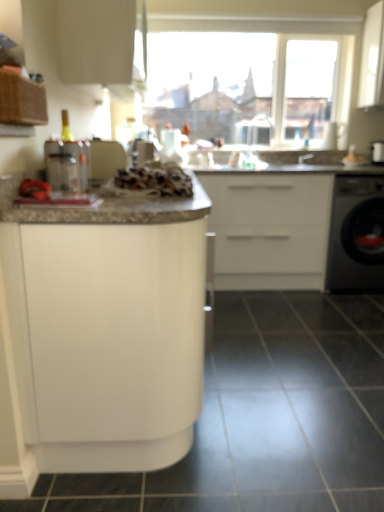
This screenshot has width=384, height=512. What do you see at coordinates (106, 328) in the screenshot?
I see `white glossy cabinet at center, which is the 1th cabinetry in bottom-to-top order` at bounding box center [106, 328].

How much space does white glossy cabinet at upper center, which is counted as the 1th cabinetry, starting from the top, occupy horizontally?

It is 14.35 inches.

This screenshot has width=384, height=512. What do you see at coordinates (266, 417) in the screenshot? I see `black glossy tile at lower center` at bounding box center [266, 417].

Locate an element on the screen. The height and width of the screenshot is (512, 384). satin nickel faucet at center, the second faucet viewed from the left is located at coordinates [x=305, y=157].

Find the location of a particular element. The height and width of the screenshot is (512, 384). white textured bread at center is located at coordinates (155, 180).

Measure the distance between white textured bread at center and camera.

1.49 meters.

What do you see at coordinates (356, 234) in the screenshot? This screenshot has height=512, width=384. I see `black glossy dishwasher at right` at bounding box center [356, 234].

Identify the location of white glossy cabinet at center, which is the 1th cabinetry in bottom-to-top order. This screenshot has width=384, height=512. (106, 328).

Based on their positions, is white glossy cabinet at upper center, which is counted as the 1th cabinetry, starting from the top, located to the left or right of transparent glass window at upper center?

white glossy cabinet at upper center, which is counted as the 1th cabinetry, starting from the top, is positioned on transparent glass window at upper center's left side.

Would you say white glossy cabinet at upper center, which is counted as the 1th cabinetry, starting from the top, contains transparent glass window at upper center?

No, transparent glass window at upper center is not a part of white glossy cabinet at upper center, which is counted as the 1th cabinetry, starting from the top.

From the image's perspective, is white matte cabinet at center, placed as the 2th cabinetry when sorted from top to bottom, located above clear plastic faucet at upper center, positioned as the second faucet in right-to-left order?

No.

Is white matte cabinet at center, placed as the 2th cabinetry when sorted from top to bottom, inside or outside of clear plastic faucet at upper center, which ranks as the first faucet in left-to-right order?

white matte cabinet at center, placed as the 2th cabinetry when sorted from top to bottom, is not enclosed by clear plastic faucet at upper center, which ranks as the first faucet in left-to-right order.

In the scene shown: Is transparent glass window at upper center at the right side of black glossy dishwasher at right?

No, transparent glass window at upper center is not to the right of black glossy dishwasher at right.

Considering the relative sizes of transparent glass window at upper center and black glossy dishwasher at right in the image provided, is transparent glass window at upper center shorter than black glossy dishwasher at right?

Incorrect, the height of transparent glass window at upper center does not fall short of that of black glossy dishwasher at right.

Are transparent glass window at upper center and black glossy dishwasher at right making contact?

No, transparent glass window at upper center is not next to black glossy dishwasher at right.

Can you confirm if clear plastic container at left is shorter than satin nickel faucet at center, placed as the first faucet when sorted from right to left?

No, clear plastic container at left is not shorter than satin nickel faucet at center, placed as the first faucet when sorted from right to left.

Considering the positions of points (114, 146) and (309, 158), is point (114, 146) closer to camera compared to point (309, 158)?

Yes, point (114, 146) is in front of point (309, 158).

Looking at the image, does clear plastic container at left seem bigger or smaller compared to satin nickel faucet at center, placed as the first faucet when sorted from right to left?

clear plastic container at left is bigger than satin nickel faucet at center, placed as the first faucet when sorted from right to left.

From the picture: How much distance is there between clear plastic container at left and satin nickel faucet at center, the second faucet viewed from the left?

clear plastic container at left is 7.13 feet from satin nickel faucet at center, the second faucet viewed from the left.

Which of these two, white glossy cabinet at upper center, positioned as the third cabinetry in bottom-to-top order, or black glossy tile at lower center, is bigger?

Bigger between the two is white glossy cabinet at upper center, positioned as the third cabinetry in bottom-to-top order.

The width and height of the screenshot is (384, 512). What are the coordinates of `tile below the white glossy cabinet at upper center, positioned as the third cabinetry in bottom-to-top order (from the image's perspective)` in the screenshot? It's located at (266, 417).

How far apart are white glossy cabinet at upper center, positioned as the third cabinetry in bottom-to-top order, and black glossy tile at lower center?

white glossy cabinet at upper center, positioned as the third cabinetry in bottom-to-top order, and black glossy tile at lower center are 5.33 feet apart.

Does white glossy cabinet at upper center, which is counted as the 1th cabinetry, starting from the top, come in front of black glossy tile at lower center?

No.

Based on the photo, from the image's perspective, between satin nickel faucet at center, placed as the first faucet when sorted from right to left, and white textured bread at center, which one is located above?

From the image's view, satin nickel faucet at center, placed as the first faucet when sorted from right to left, is above.

Considering the relative sizes of satin nickel faucet at center, placed as the first faucet when sorted from right to left, and white textured bread at center in the image provided, is satin nickel faucet at center, placed as the first faucet when sorted from right to left, taller than white textured bread at center?

In fact, satin nickel faucet at center, placed as the first faucet when sorted from right to left, may be shorter than white textured bread at center.

How many degrees apart are the facing directions of satin nickel faucet at center, placed as the first faucet when sorted from right to left, and white textured bread at center?

There is a 89.7-degree angle between the facing directions of satin nickel faucet at center, placed as the first faucet when sorted from right to left, and white textured bread at center.

The height and width of the screenshot is (512, 384). There is a white textured bread at center. What are the coordinates of `the 1st faucet above it (from the image's perspective)` in the screenshot? It's located at (305, 157).

Is clear plastic container at left not close to transparent glass window at upper center?

Yes, clear plastic container at left is far from transparent glass window at upper center.

Does clear plastic container at left have a lesser height compared to transparent glass window at upper center?

Yes.

Looking at this image, from the image's perspective, between clear plastic container at left and transparent glass window at upper center, who is located below?

From the image's view, clear plastic container at left is below.

Who is more distant, clear plastic container at left or transparent glass window at upper center?

transparent glass window at upper center.

There is a transparent glass window at upper center. Identify the location of the 1st cabinetry below it (from the image's perspective). (103, 41).

From a real-world perspective, which cabinetry is the 2nd one underneath the clear plastic faucet at upper center, which ranks as the first faucet in left-to-right order? Please provide its 2D coordinates.

[(269, 229)]

When comparing their distances from white glossy cabinet at upper center, which is counted as the 1th cabinetry, starting from the top, does clear plastic container at left or clear plastic faucet at upper center, positioned as the second faucet in right-to-left order, seem closer?

Among the two, clear plastic container at left is located nearer to white glossy cabinet at upper center, which is counted as the 1th cabinetry, starting from the top.

Looking at the image, which one is located closer to white glossy cabinet at upper center, positioned as the third cabinetry in bottom-to-top order, transparent glass window at upper center or black glossy dishwasher at right?

transparent glass window at upper center.

Looking at the image, which one is located further to satin nickel faucet at center, the second faucet viewed from the left, clear plastic container at left or clear plastic faucet at upper center, positioned as the second faucet in right-to-left order?

clear plastic container at left.

Based on their spatial positions, is clear plastic faucet at upper center, which ranks as the first faucet in left-to-right order, or white glossy cabinet at upper center, which is counted as the 1th cabinetry, starting from the top, further from black glossy dishwasher at right?

The object further to black glossy dishwasher at right is white glossy cabinet at upper center, which is counted as the 1th cabinetry, starting from the top.

Which object lies further to the anchor point white textured bread at center, black glossy dishwasher at right or clear plastic faucet at upper center, positioned as the second faucet in right-to-left order?

clear plastic faucet at upper center, positioned as the second faucet in right-to-left order, is positioned further to the anchor white textured bread at center.

Consider the image. Which object lies nearer to the anchor point black glossy dishwasher at right, clear plastic faucet at upper center, positioned as the second faucet in right-to-left order, or black glossy tile at lower center?

clear plastic faucet at upper center, positioned as the second faucet in right-to-left order, is positioned closer to the anchor black glossy dishwasher at right.

Estimate the real-world distances between objects in this image. Which object is closer to white textured bread at center, clear plastic container at left or satin nickel faucet at center, placed as the first faucet when sorted from right to left?

clear plastic container at left is positioned closer to the anchor white textured bread at center.

In the scene shown: Which object lies nearer to the anchor point clear plastic faucet at upper center, positioned as the second faucet in right-to-left order, satin nickel faucet at center, the second faucet viewed from the left, or white glossy cabinet at upper center, positioned as the third cabinetry in bottom-to-top order?

satin nickel faucet at center, the second faucet viewed from the left, is positioned closer to the anchor clear plastic faucet at upper center, positioned as the second faucet in right-to-left order.

Locate an element on the screen. This screenshot has height=512, width=384. home appliance between transparent glass window at upper center and white matte cabinet at center, placed as the 2th cabinetry when sorted from top to bottom, from top to bottom is located at coordinates (356, 234).

This screenshot has height=512, width=384. Find the location of `food situated between white glossy cabinet at center, which is counted as the 3th cabinetry, starting from the top, and black glossy tile at lower center from left to right`. food situated between white glossy cabinet at center, which is counted as the 3th cabinetry, starting from the top, and black glossy tile at lower center from left to right is located at coordinates (155, 180).

The width and height of the screenshot is (384, 512). I want to click on faucet between clear plastic container at left and satin nickel faucet at center, placed as the first faucet when sorted from right to left, from front to back, so click(x=258, y=133).

The width and height of the screenshot is (384, 512). Identify the location of appliance positioned between black glossy tile at lower center and satin nickel faucet at center, placed as the first faucet when sorted from right to left, from near to far. click(89, 159).